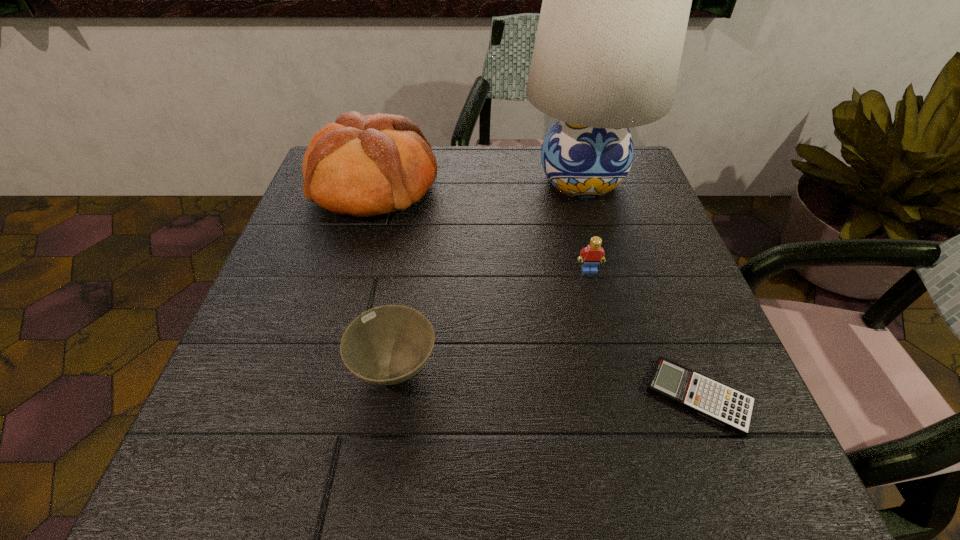
I want to click on the tallest object, so click(616, 1).

Image resolution: width=960 pixels, height=540 pixels. Find the location of `bread`. bread is located at coordinates (364, 166).

Image resolution: width=960 pixels, height=540 pixels. What are the coordinates of `Lego` in the screenshot? It's located at (593, 254).

At what (x,y) coordinates should I click in order to perform the action: click on bowl. Please return your answer as a coordinate pair (x, y). Looking at the image, I should click on (386, 345).

This screenshot has height=540, width=960. Identify the location of calculator. (723, 405).

Locate an element on the screen. vacant space located 0.070m on the front-facing side of the lampshade is located at coordinates (598, 240).

What are the coordinates of `free location located on the right of the fourth shortest object` in the screenshot? It's located at (538, 186).

Locate an element on the screen. The height and width of the screenshot is (540, 960). vacant space located 0.080m on the front-facing side of the Lego is located at coordinates (597, 305).

At what (x,y) coordinates should I click in order to perform the action: click on vacant area located on the back of the bowl. Please return your answer as a coordinate pair (x, y). This screenshot has width=960, height=540. Looking at the image, I should click on (414, 241).

You are a GUI agent. You are given a task and a screenshot of the screen. Output one action in this format:
    pyautogui.click(x=<x>, y=<y>)
    Task: Click on the free space located 0.190m on the left of the calculator
    
    Given the screenshot: What is the action you would take?
    pyautogui.click(x=524, y=397)